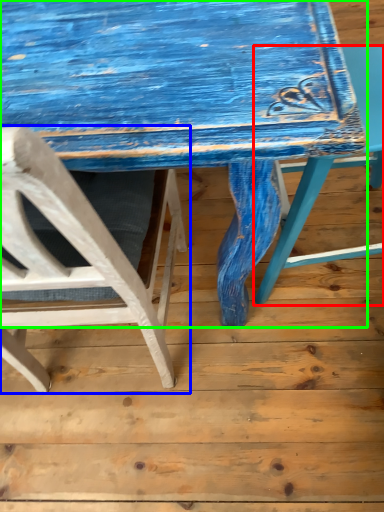
Question: Which object is the farthest from chair (highlighted by a red box)? Choose among these: chair (highlighted by a blue box) or table (highlighted by a green box).

Choices:
 (A) chair
 (B) table

Answer: (A)